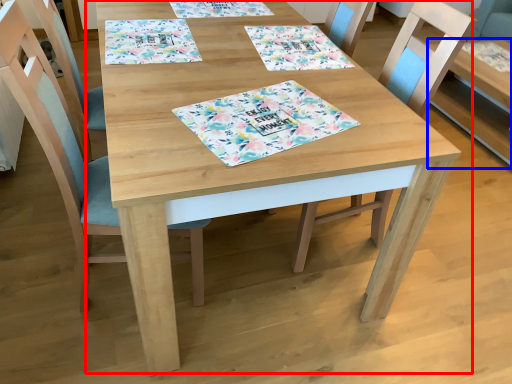
Question: Which object appears farthest to the camera in this image, table (highlighted by a red box) or table (highlighted by a blue box)?

Choices:
 (A) table
 (B) table

Answer: (B)